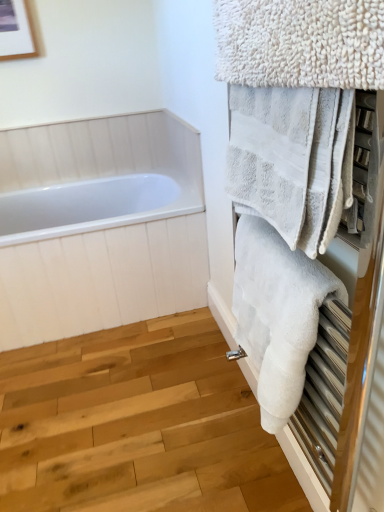
Where is `vacant region under white fluffy towel at right, marked as the 3th towel in a top-to-bottom arrangement (from a real-world perspective)`? vacant region under white fluffy towel at right, marked as the 3th towel in a top-to-bottom arrangement (from a real-world perspective) is located at coordinates (254, 466).